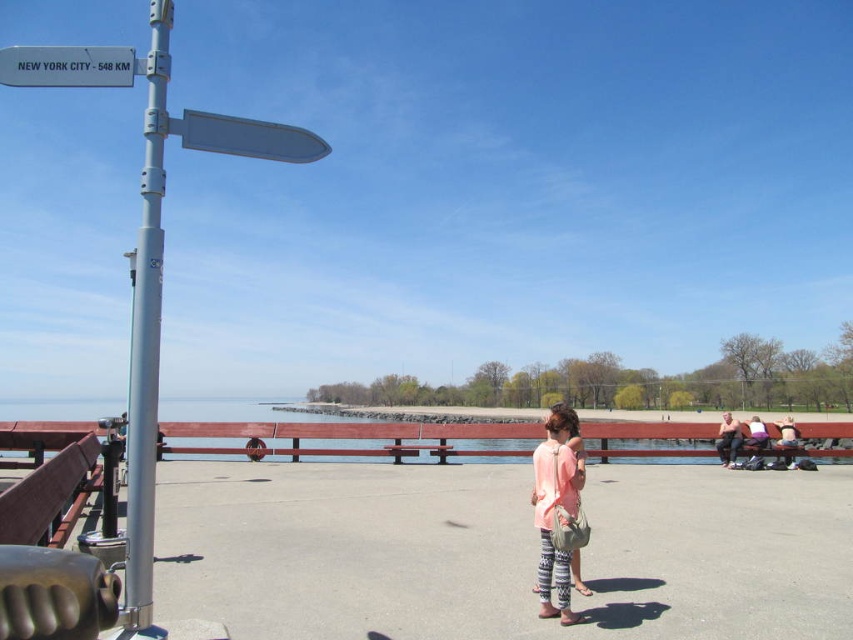
Is metallic gray sign at upper center bigger than tan leather jacket at right?

Yes, metallic gray sign at upper center is bigger than tan leather jacket at right.

Between metallic gray sign at upper center and tan leather jacket at right, which one appears on the right side from the viewer's perspective?

tan leather jacket at right is more to the right.

Does point (223, 134) come farther from viewer compared to point (726, 465)?

No, (223, 134) is closer to viewer.

Locate an element on the screen. The width and height of the screenshot is (853, 640). metallic gray sign at upper center is located at coordinates (250, 138).

Is point (544, 611) more distant than point (756, 467)?

No, it is in front of (756, 467).

Is light pink fabric dress at center to the left of light purple fabric at lower right from the viewer's perspective?

Yes, light pink fabric dress at center is to the left of light purple fabric at lower right.

Image resolution: width=853 pixels, height=640 pixels. What do you see at coordinates (556, 508) in the screenshot? I see `light pink fabric dress at center` at bounding box center [556, 508].

I want to click on light pink fabric dress at center, so click(x=556, y=508).

Does metallic gray sign at upper center appear under pink fabric person at right?

Incorrect, metallic gray sign at upper center is not positioned below pink fabric person at right.

Does metallic gray sign at upper center come behind pink fabric person at right?

That is False.

Who is more distant from viewer, [264,134] or [788,468]?

The point [788,468] is behind.

This screenshot has height=640, width=853. In order to click on metallic gray sign at upper center in this screenshot , I will do `click(250, 138)`.